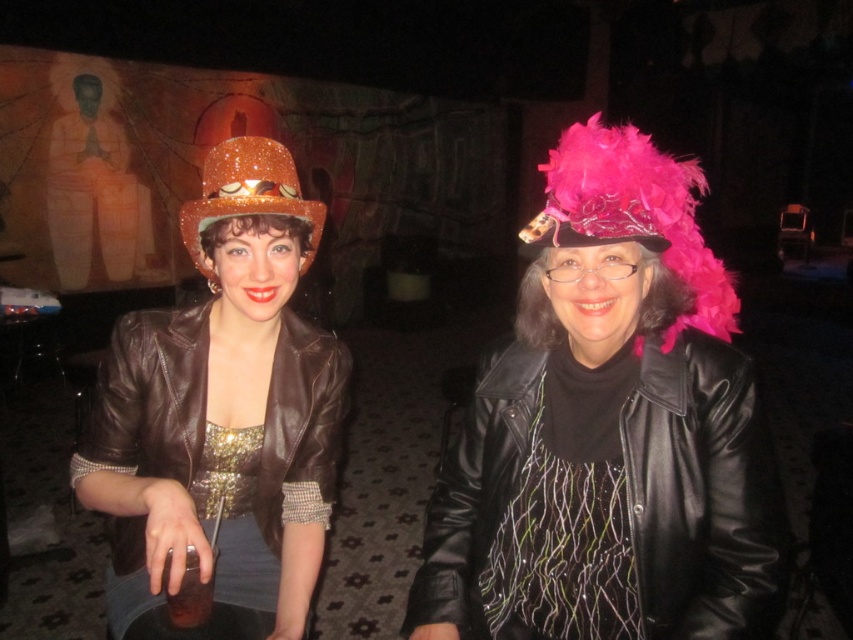
Consider the image. Who is more distant from viewer, (567, 625) or (741, 410)?

The point (567, 625) is more distant.

From the picture: Can you confirm if matte brown leather jacket at left is positioned to the right of black leather jacket at center?

In fact, matte brown leather jacket at left is to the left of black leather jacket at center.

This screenshot has width=853, height=640. I want to click on matte brown leather jacket at left, so click(608, 432).

Does black sequined dress at center appear under shiny orange hat at left?

Yes.

Based on the photo, can you confirm if black sequined dress at center is wider than shiny orange hat at left?

Yes.

Where is `black sequined dress at center`? This screenshot has height=640, width=853. black sequined dress at center is located at coordinates (567, 515).

Which is more to the left, shiny brown leather jacket at left or black leather jacket at center?

shiny brown leather jacket at left is more to the left.

Who is more distant from viewer, (117, 451) or (509, 493)?

Positioned behind is point (117, 451).

Where is `shiny brown leather jacket at left`? The width and height of the screenshot is (853, 640). shiny brown leather jacket at left is located at coordinates (221, 413).